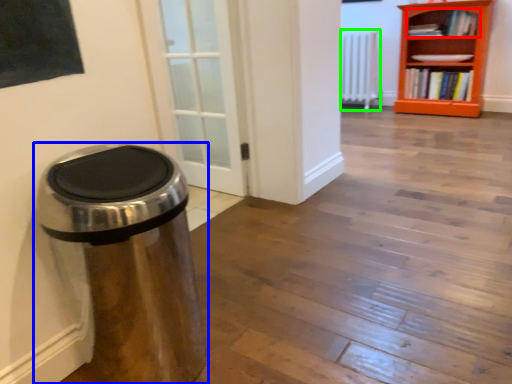
Question: Considering the real-world distances, which object is farthest from book (highlighted by a red box)? waste container (highlighted by a blue box) or radiator (highlighted by a green box)?

Choices:
 (A) waste container
 (B) radiator

Answer: (A)